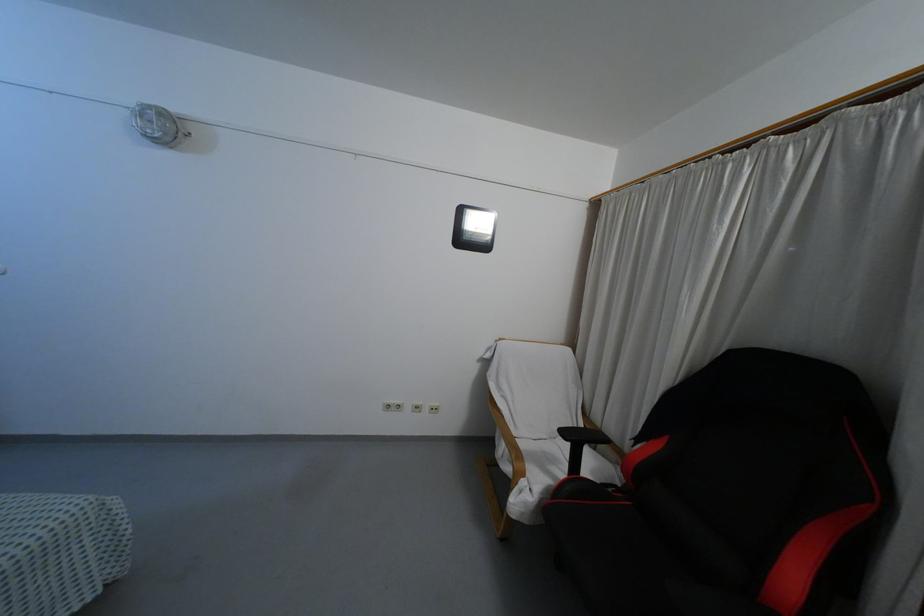
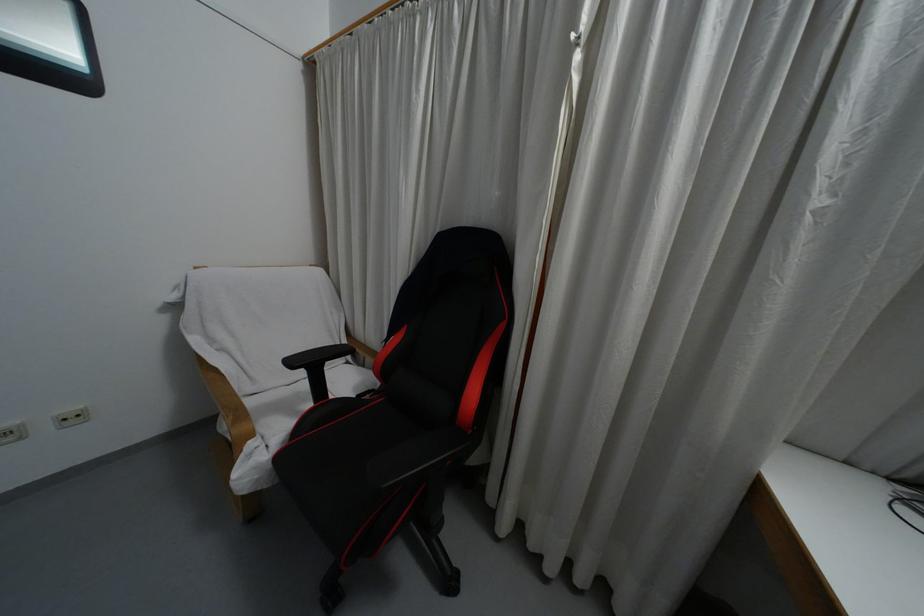
Where in the second image is the point corresponding to (523,474) from the first image?

(250, 435)